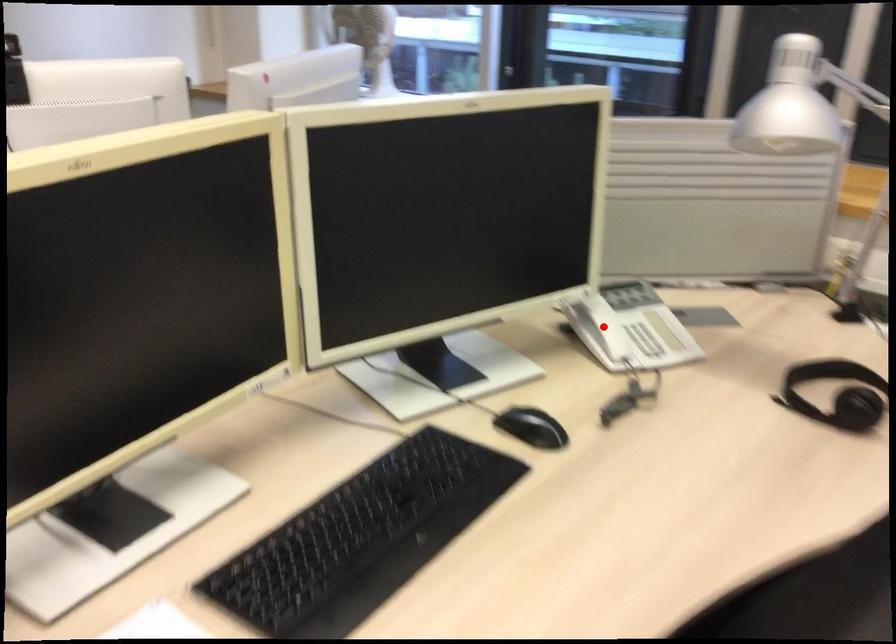
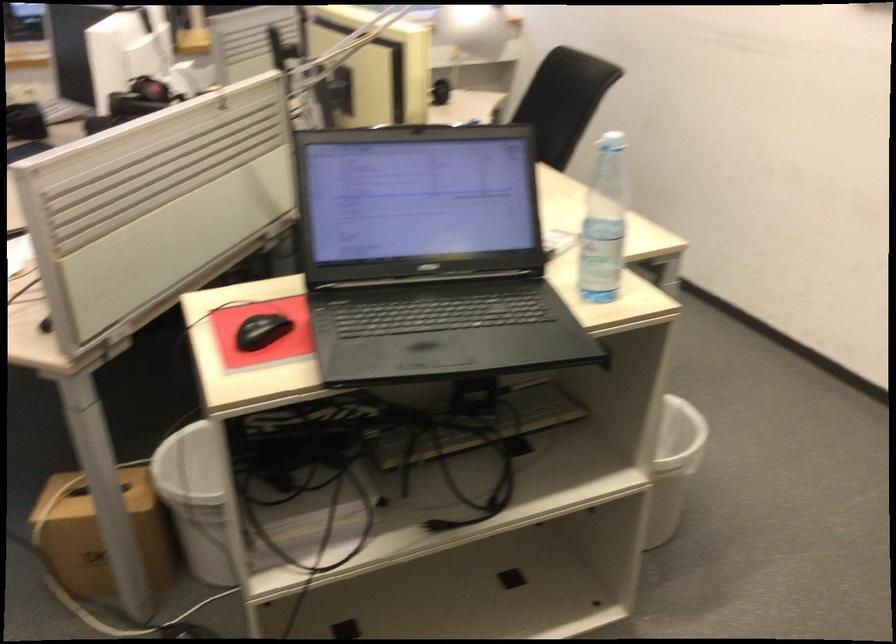
Question: I am providing you with two images of the same scene from different viewpoints. A red point is marked on the first image. At the location where the point appears in image 1, is it still visible in image 2?

Choices:
 (A) Yes
 (B) No

Answer: (B)